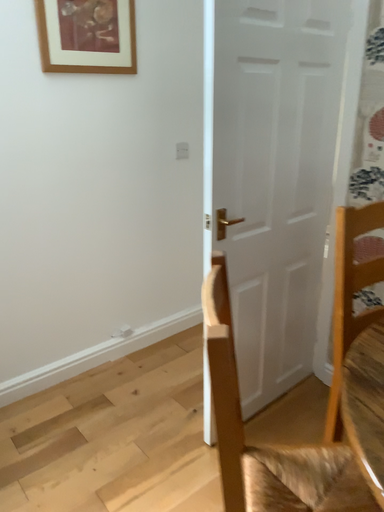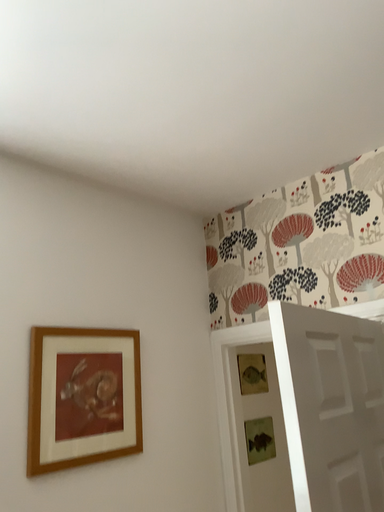
Question: How did the camera likely rotate when shooting the video?

Choices:
 (A) rotated downward
 (B) rotated upward

Answer: (B)